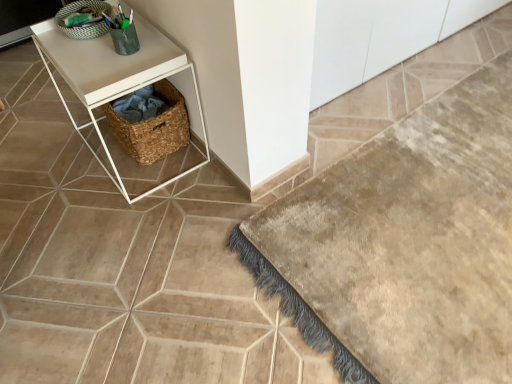
At what (x,y) coordinates should I click in order to perform the action: click on vacant area that is in front of green woven basket at upper left, positioned as the 1th basket in top-to-bottom order. Please return your answer as a coordinate pair (x, y). This screenshot has height=384, width=512. Looking at the image, I should click on (74, 58).